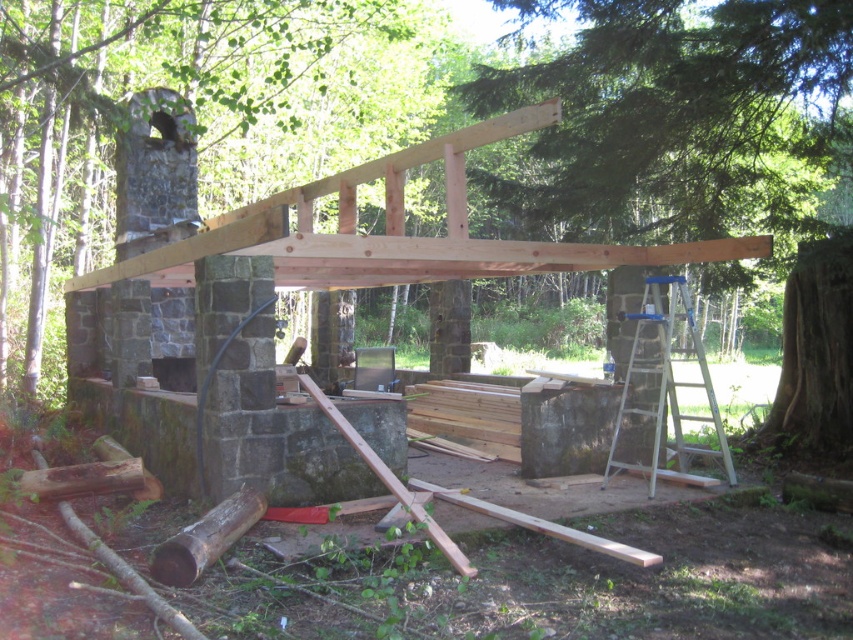
You are a construction worker standing at the base of the stone pillars. You need to retrieve a tool from the natural wood beam at center and then climb the metallic silver ladder at right. Which object should you approach first based on their positions?

You should approach the natural wood beam at center first since it is located to the left of the metallic silver ladder at right, meaning it is closer to your starting position at the base of the stone pillars.

You are an inspector checking the construction site. You need to determine if there is enough space to move the metallic silver ladder at right to the natural wood beam at center. Based on the scene, can the ladder fit in the space occupied by the beam?

The natural wood beam at center occupies less space than metallic silver ladder at right, so the space currently occupied by the natural wood beam at center is smaller than the ladder. Therefore, moving the metallic silver ladder at right to the natural wood beam at center would not be possible due to insufficient space.

You are standing at the origin point in the construction site. Where is the natural wood beam at center located in relation to your position?

The natural wood beam at center is located at point 0.247 units to the right and 0.829 units downward from your position.